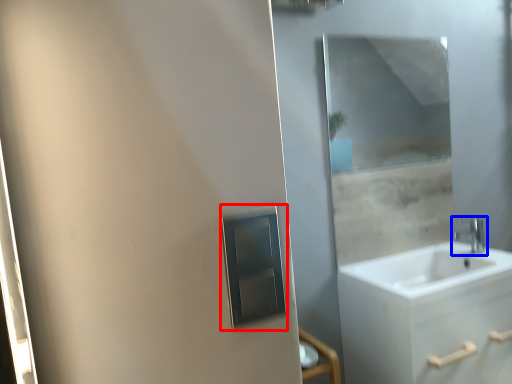
Question: Which object is further to the camera taking this photo, medicine cabinet (highlighted by a red box) or tap (highlighted by a blue box)?

Choices:
 (A) medicine cabinet
 (B) tap

Answer: (B)